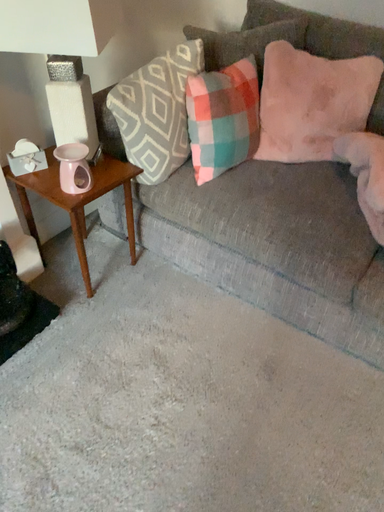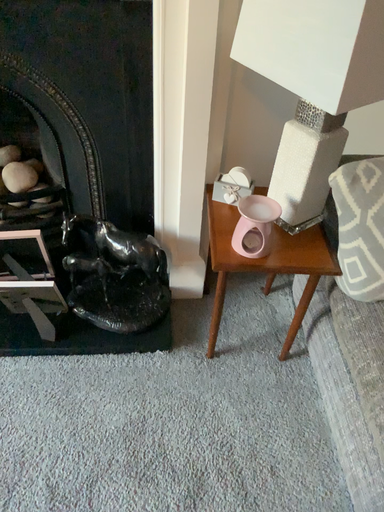
Question: How did the camera likely rotate when shooting the video?

Choices:
 (A) rotated downward
 (B) rotated upward

Answer: (B)